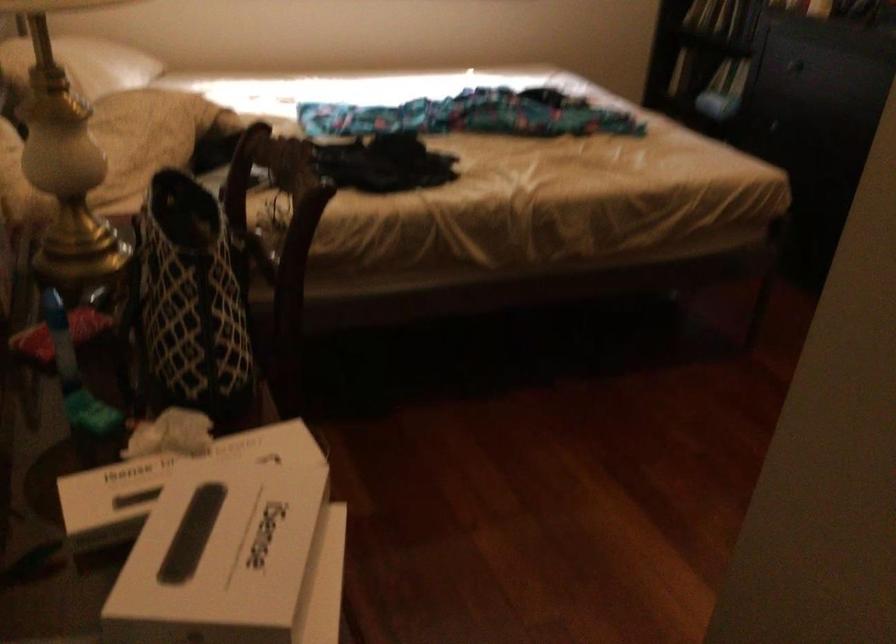
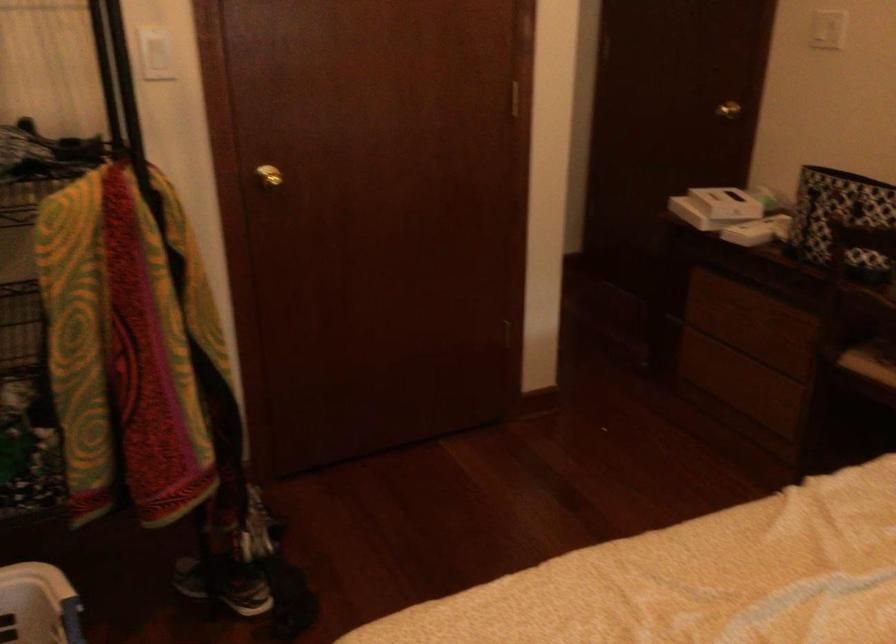
Question: I am providing you with two images of the same scene from different viewpoints. Please identify which objects are invisible in image2.

Choices:
 (A) white box
 (B) white light switch
 (C) white fan buttons
 (D) patterned tote bag

Answer: (D)